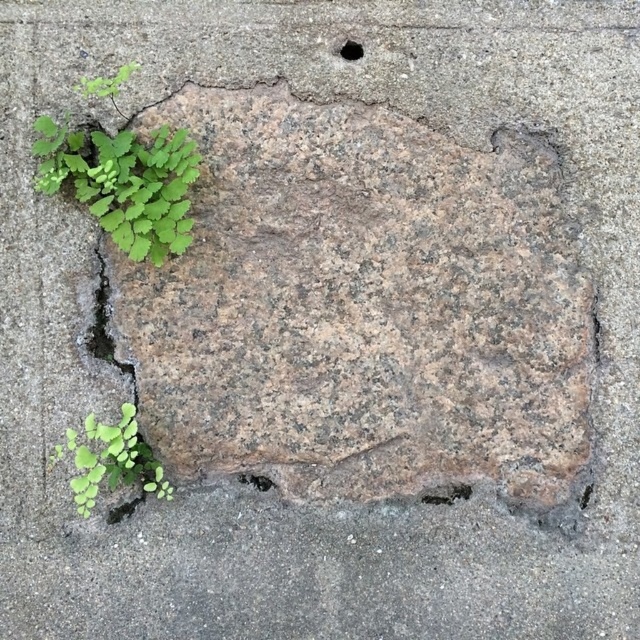
You are a gardener assessing the growth potential of the green leafy plant at lower left and the black smooth hole at upper center. Which object has a greater height?

The green leafy plant at lower left is taller than the black smooth hole at upper center according to the description provided.

You are a geologist examining a concrete surface with a crack and a green plant growing out of it. You notice a specific point at coordinates point (360, 307). What is the material at this point?

The point (360, 307) corresponds to brown rough stone at center.

You are a gardener trying to locate the green leafy plant at lower left and the black smooth hole at upper center. Based on the scene, which object is closer to the left edge of the concrete surface?

The green leafy plant at lower left is closer to the left edge of the concrete surface because it is positioned on the left side of the black smooth hole at upper center.